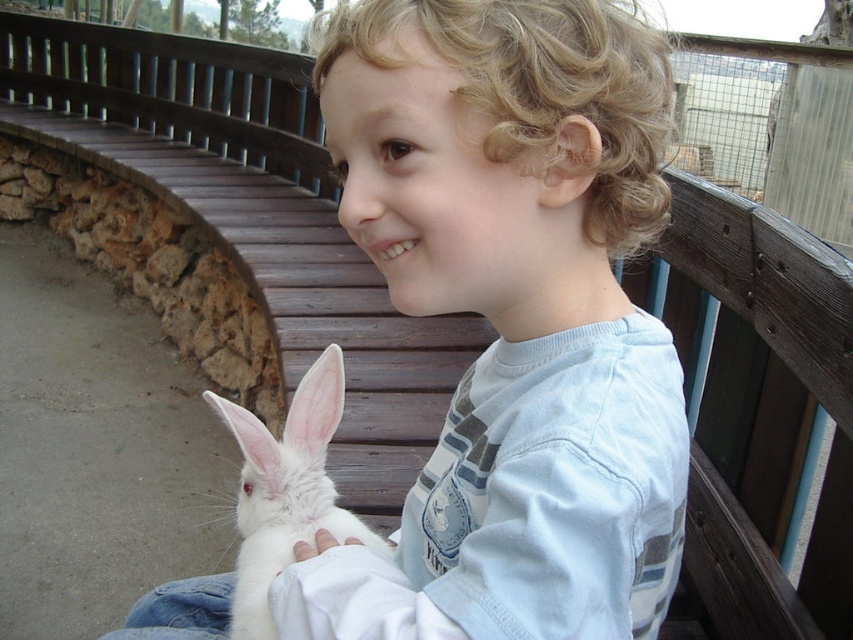
Does point (508, 116) come in front of point (341, 515)?

Yes, point (508, 116) is in front of point (341, 515).

Can you confirm if white soft fur rabbit at center is bigger than white fluffy rabbit at lower left?

Yes, white soft fur rabbit at center is bigger than white fluffy rabbit at lower left.

Who is more distant from viewer, (463,605) or (312,404)?

Positioned behind is point (312,404).

Where is `white soft fur rabbit at center`? Image resolution: width=853 pixels, height=640 pixels. white soft fur rabbit at center is located at coordinates (509, 317).